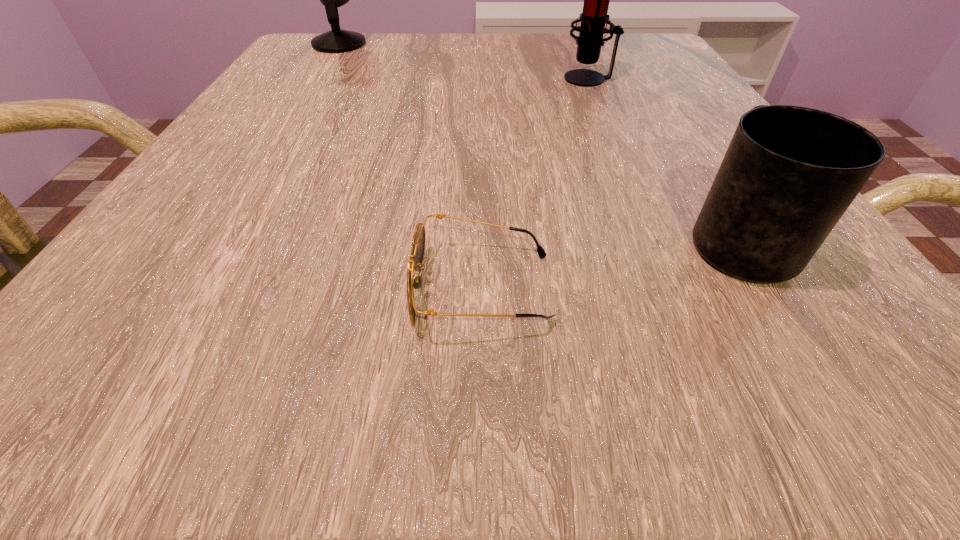
The width and height of the screenshot is (960, 540). I want to click on object present at the far right corner, so click(593, 18).

In the image, there is a desktop. At what (x,y) coordinates should I click in order to perform the action: click on vacant space at the far edge. Please return your answer as a coordinate pair (x, y). This screenshot has width=960, height=540. Looking at the image, I should click on (423, 48).

Where is `vacant space at the near edge of the desktop`? This screenshot has height=540, width=960. vacant space at the near edge of the desktop is located at coordinates (312, 389).

Identify the location of vacant region at the left edge of the desktop. The width and height of the screenshot is (960, 540). (205, 249).

Locate an element on the screen. The image size is (960, 540). free space at the right edge is located at coordinates (706, 180).

The width and height of the screenshot is (960, 540). I want to click on vacant region at the near left corner of the desktop, so click(x=193, y=362).

Where is `vacant space at the far right corner of the desktop`? The image size is (960, 540). vacant space at the far right corner of the desktop is located at coordinates click(636, 76).

Locate an element on the screen. Image resolution: width=960 pixels, height=540 pixels. vacant space at the near right corner of the desktop is located at coordinates (770, 354).

In order to click on free space between the mug and the left microphone in this screenshot , I will do `click(539, 141)`.

Find the location of a particular element. The width and height of the screenshot is (960, 540). free spot between the left microphone and the second object from left to right is located at coordinates (410, 166).